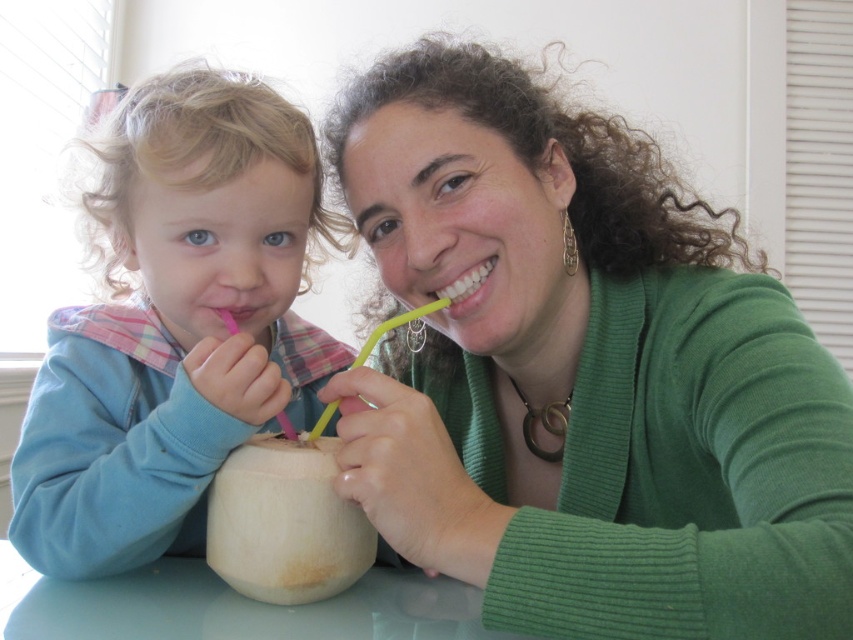
From the picture: You are a guest entering the room and want to place a new item between the blue fleece jacket at left and the yellow plastic straw at center. Which object should you place the item closer to if you want it to be closer to the taller object?

The blue fleece jacket at left is taller than the yellow plastic straw at center, so placing the item closer to the blue fleece jacket at left would make it closer to the taller object.

You are a delivery person trying to place a small package between the blue fleece jacket at left and the pink plastic straw at left on the table. Can you fit it there?

The blue fleece jacket at left might be wider than the pink plastic straw at left, so there may not be enough space for the package between them.

You are a guest at this cozy home and want to borrow the pink plastic straw at left. The blue fleece jacket at left is in the way. Can you lift the jacket to access the straw?

The blue fleece jacket at left is taller than the pink plastic straw at left, so lifting the jacket would allow access to the pink plastic straw at left.